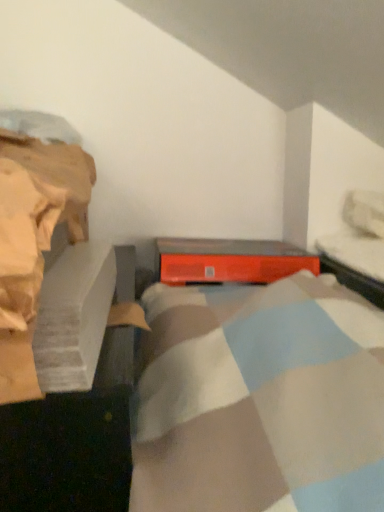
Question: From the image's perspective, is orange matte speaker at center over metallic gray bed frame at upper right?

Choices:
 (A) no
 (B) yes

Answer: (A)

Question: From a real-world perspective, is orange matte speaker at center over metallic gray bed frame at upper right?

Choices:
 (A) yes
 (B) no

Answer: (B)

Question: Would you say orange matte speaker at center is a long distance from metallic gray bed frame at upper right?

Choices:
 (A) no
 (B) yes

Answer: (A)

Question: Does orange matte speaker at center have a lesser height compared to metallic gray bed frame at upper right?

Choices:
 (A) no
 (B) yes

Answer: (A)

Question: Could you tell me if orange matte speaker at center is turned towards metallic gray bed frame at upper right?

Choices:
 (A) yes
 (B) no

Answer: (B)

Question: Does orange matte speaker at center appear on the left side of metallic gray bed frame at upper right?

Choices:
 (A) no
 (B) yes

Answer: (B)

Question: Is the position of metallic gray bed frame at upper right more distant than that of orange matte speaker at center?

Choices:
 (A) no
 (B) yes

Answer: (A)

Question: Is metallic gray bed frame at upper right beside orange matte speaker at center?

Choices:
 (A) no
 (B) yes

Answer: (A)

Question: From a real-world perspective, is metallic gray bed frame at upper right under orange matte speaker at center?

Choices:
 (A) yes
 (B) no

Answer: (B)

Question: From the image's perspective, is metallic gray bed frame at upper right under orange matte speaker at center?

Choices:
 (A) no
 (B) yes

Answer: (A)

Question: Is metallic gray bed frame at upper right positioned beyond the bounds of orange matte speaker at center?

Choices:
 (A) yes
 (B) no

Answer: (A)

Question: Is metallic gray bed frame at upper right at the right side of orange matte speaker at center?

Choices:
 (A) yes
 (B) no

Answer: (A)

Question: Is point (185, 272) closer or farther from the camera than point (375, 302)?

Choices:
 (A) farther
 (B) closer

Answer: (A)